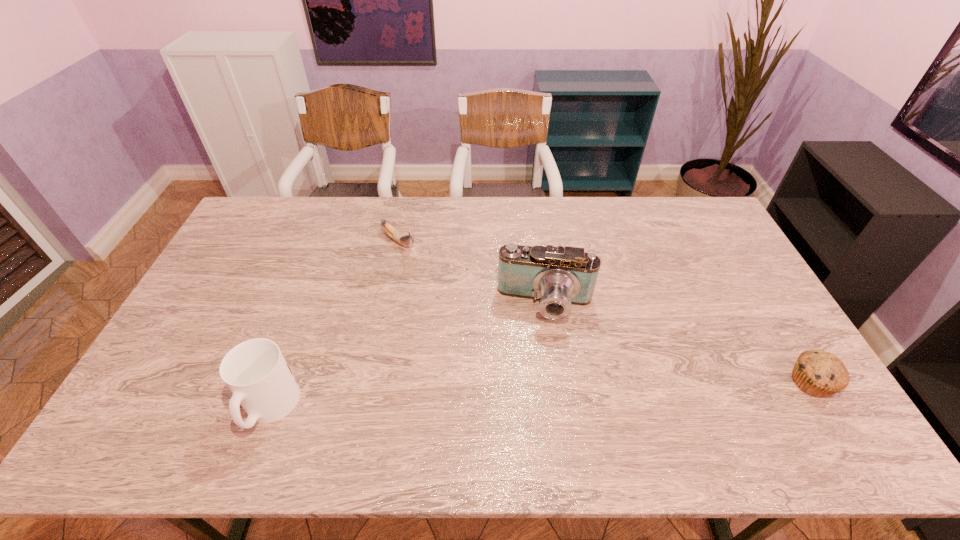
Where is `the leftmost object`? the leftmost object is located at coordinates (255, 371).

Locate an element on the screen. The width and height of the screenshot is (960, 540). muffin is located at coordinates (818, 373).

This screenshot has height=540, width=960. In order to click on the second farthest object in this screenshot , I will do `click(559, 277)`.

This screenshot has height=540, width=960. In order to click on the third object from left to right in this screenshot , I will do `click(559, 277)`.

The width and height of the screenshot is (960, 540). I want to click on the farthest object, so click(405, 240).

Image resolution: width=960 pixels, height=540 pixels. I want to click on the third object from right to left, so click(x=405, y=240).

I want to click on blank area located on the back of the rightmost object, so click(765, 305).

You are a GUI agent. You are given a task and a screenshot of the screen. Output one action in this format:
    pyautogui.click(x=<x>, y=<y>)
    Task: Click on the free space located 0.190m on the front-facing side of the second farthest object
    The image size is (960, 540).
    Given the screenshot: What is the action you would take?
    pyautogui.click(x=535, y=384)

Locate an element on the screen. vacant space situated 0.200m on the front-facing side of the second farthest object is located at coordinates (535, 388).

This screenshot has height=540, width=960. In order to click on vacant region located on the front-facing side of the second farthest object in this screenshot , I will do `click(534, 398)`.